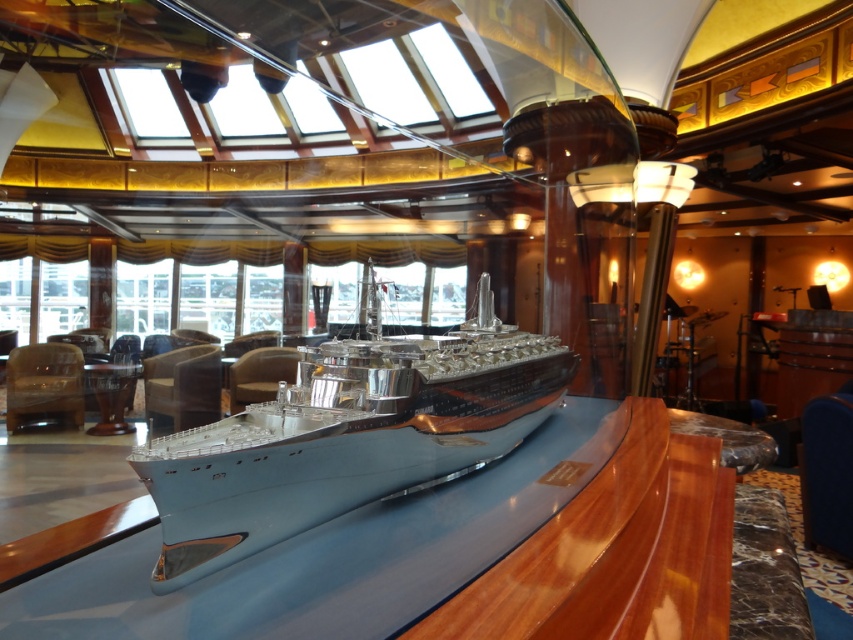
Does leather armchair at center have a greater width compared to matte brown leather armchair at center?

Yes, leather armchair at center is wider than matte brown leather armchair at center.

Between leather armchair at center and matte brown leather armchair at center, which one is positioned lower?

leather armchair at center

Find the location of a particular element. The image size is (853, 640). leather armchair at center is located at coordinates (183, 388).

This screenshot has height=640, width=853. What do you see at coordinates (347, 436) in the screenshot? I see `light blue metallic ship at center` at bounding box center [347, 436].

Is point (129, 454) closer to camera compared to point (7, 365)?

That is True.

Identify the location of light blue metallic ship at center. (347, 436).

Is light blue metallic ship at center positioned behind matte brown leather armchair at center?

That is False.

Which is behind, point (459, 420) or point (263, 356)?

Point (263, 356)

In order to click on light blue metallic ship at center in this screenshot , I will do `click(347, 436)`.